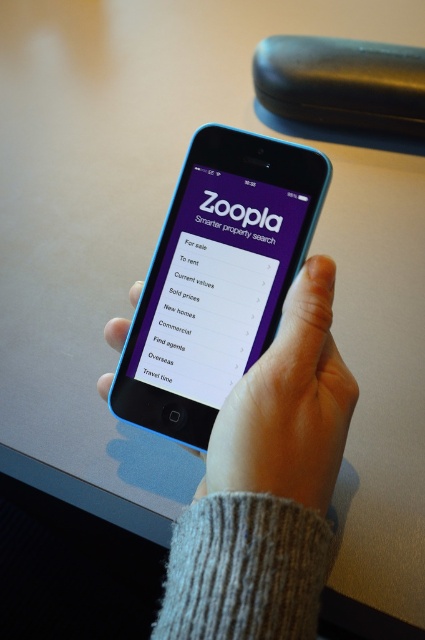
Is gray knitted sweater at center to the left of smooth skin hand at center from the viewer's perspective?

Indeed, gray knitted sweater at center is positioned on the left side of smooth skin hand at center.

Who is more forward, (227,449) or (274,442)?

Point (274,442) is in front.

Where is `gray knitted sweater at center`? The width and height of the screenshot is (425, 640). gray knitted sweater at center is located at coordinates tap(266, 486).

Can you confirm if gray knitted sweater at center is thinner than blue plastic smartphone at center?

No.

Is point (339, 461) more distant than point (283, 232)?

No, it is not.

Locate an element on the screen. Image resolution: width=425 pixels, height=640 pixels. gray knitted sweater at center is located at coordinates (266, 486).

Based on the photo, can you confirm if blue plastic smartphone at center is taller than purple matte screen at center?

Yes, blue plastic smartphone at center is taller than purple matte screen at center.

From the picture: Does blue plastic smartphone at center have a greater width compared to purple matte screen at center?

Yes.

Which is in front, point (246, 189) or point (248, 320)?

Point (248, 320) is in front.

You are a GUI agent. You are given a task and a screenshot of the screen. Output one action in this format:
    pyautogui.click(x=<x>, y=<y>)
    Task: Click on the blue plastic smartphone at center
    This screenshot has height=640, width=425.
    Given the screenshot: What is the action you would take?
    pyautogui.click(x=217, y=278)